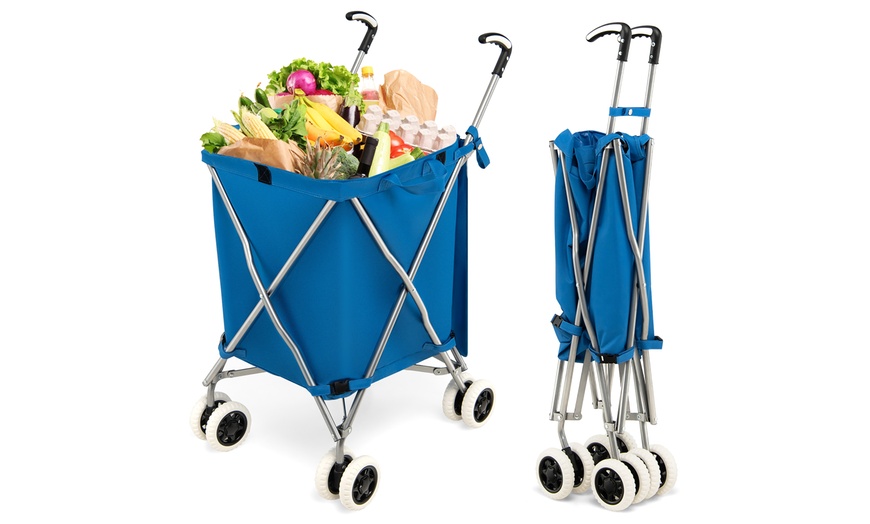
You are a GUI agent. You are given a task and a screenshot of the screen. Output one action in this format:
    pyautogui.click(x=<x>, y=<y>)
    Task: Click on the trolley
    This screenshot has width=870, height=524.
    Given the screenshot: What is the action you would take?
    pyautogui.click(x=365, y=341), pyautogui.click(x=606, y=294)